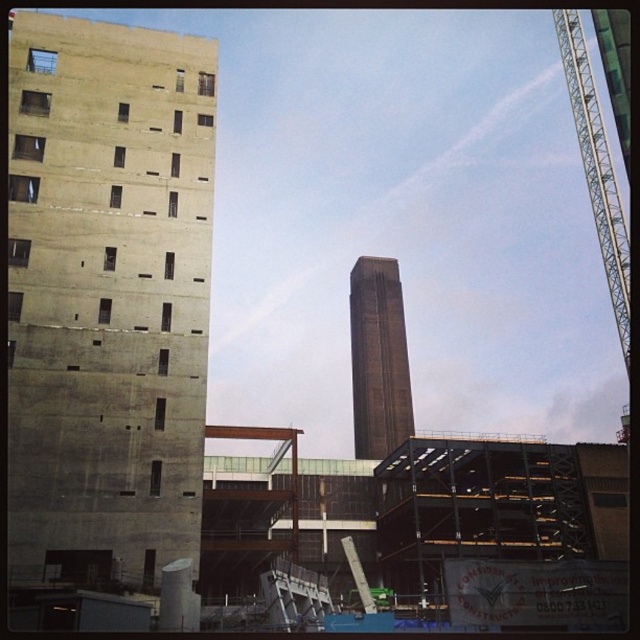
Question: Among these points, which one is nearest to the camera?

Choices:
 (A) (374, 436)
 (B) (202, 324)
 (C) (566, 72)

Answer: (B)

Question: Is the position of brown brick tower at center more distant than that of green metallic crane at upper right?

Choices:
 (A) yes
 (B) no

Answer: (A)

Question: Among these objects, which one is nearest to the camera?

Choices:
 (A) brown brick tower at center
 (B) concrete tower at left

Answer: (B)

Question: Can you confirm if brown brick tower at center is positioned to the right of green metallic crane at upper right?

Choices:
 (A) no
 (B) yes

Answer: (A)

Question: Is brown brick tower at center thinner than green metallic crane at upper right?

Choices:
 (A) yes
 (B) no

Answer: (A)

Question: Which point is farther from the camera taking this photo?

Choices:
 (A) (120, 244)
 (B) (582, 125)

Answer: (B)